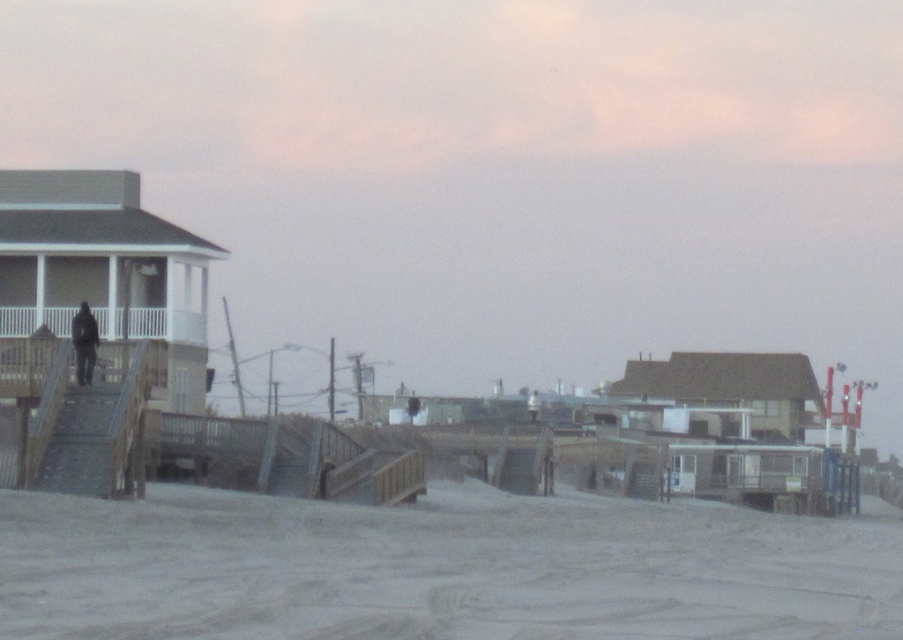
Between sandy beach at lower left and metallic gray stairs at left, which one appears on the left side from the viewer's perspective?

metallic gray stairs at left is more to the left.

Can you confirm if sandy beach at lower left is smaller than metallic gray stairs at left?

Actually, sandy beach at lower left might be larger than metallic gray stairs at left.

Which is in front, point (110, 516) or point (96, 440)?

Point (110, 516) is more forward.

Find the location of a particular element. sandy beach at lower left is located at coordinates (436, 570).

Is sandy beach at lower left bigger than dark gray fabric jacket at left?

Yes, sandy beach at lower left is bigger than dark gray fabric jacket at left.

Between point (129, 602) and point (91, 348), which one is positioned in front?

Positioned in front is point (129, 602).

Locate an element on the screen. The width and height of the screenshot is (903, 640). sandy beach at lower left is located at coordinates (436, 570).

Does metallic gray stairs at left appear on the right side of dark gray fabric jacket at left?

Yes, metallic gray stairs at left is to the right of dark gray fabric jacket at left.

Consider the image. Is the position of metallic gray stairs at left more distant than that of dark gray fabric jacket at left?

No, metallic gray stairs at left is in front of dark gray fabric jacket at left.

At what (x,y) coordinates should I click in order to perform the action: click on metallic gray stairs at left. Please return your answer as a coordinate pair (x, y). This screenshot has width=903, height=640. Looking at the image, I should click on (81, 444).